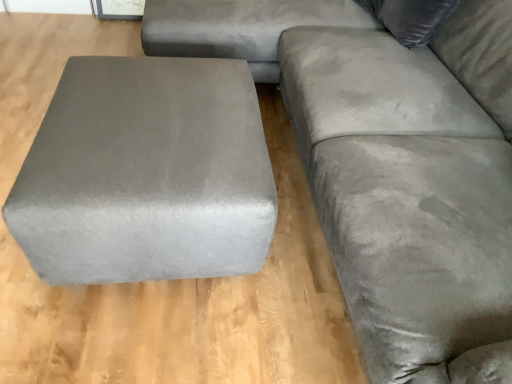
Question: Should I look upward or downward to see suede gray couch at right?

Choices:
 (A) down
 (B) up

Answer: (B)

Question: From a real-world perspective, is satin gray ottoman at left physically above velvet gray pillow at upper right?

Choices:
 (A) yes
 (B) no

Answer: (B)

Question: From the image's perspective, would you say satin gray ottoman at left is shown under velvet gray pillow at upper right?

Choices:
 (A) yes
 (B) no

Answer: (A)

Question: Can you confirm if satin gray ottoman at left is positioned to the left of velvet gray pillow at upper right?

Choices:
 (A) no
 (B) yes

Answer: (B)

Question: Does satin gray ottoman at left have a lesser height compared to velvet gray pillow at upper right?

Choices:
 (A) no
 (B) yes

Answer: (A)

Question: Is satin gray ottoman at left not near velvet gray pillow at upper right?

Choices:
 (A) no
 (B) yes

Answer: (B)

Question: Can you confirm if satin gray ottoman at left is bigger than velvet gray pillow at upper right?

Choices:
 (A) no
 (B) yes

Answer: (B)

Question: Is the position of suede gray couch at right less distant than that of satin gray ottoman at left?

Choices:
 (A) no
 (B) yes

Answer: (B)

Question: Can you confirm if suede gray couch at right is bigger than satin gray ottoman at left?

Choices:
 (A) no
 (B) yes

Answer: (B)

Question: Is the surface of suede gray couch at right in direct contact with satin gray ottoman at left?

Choices:
 (A) yes
 (B) no

Answer: (B)

Question: Can you confirm if suede gray couch at right is thinner than satin gray ottoman at left?

Choices:
 (A) no
 (B) yes

Answer: (A)

Question: From the image's perspective, is suede gray couch at right above satin gray ottoman at left?

Choices:
 (A) yes
 (B) no

Answer: (A)

Question: Is suede gray couch at right positioned far away from satin gray ottoman at left?

Choices:
 (A) yes
 (B) no

Answer: (B)

Question: Does velvet gray pillow at upper right have a greater height compared to satin gray ottoman at left?

Choices:
 (A) yes
 (B) no

Answer: (B)